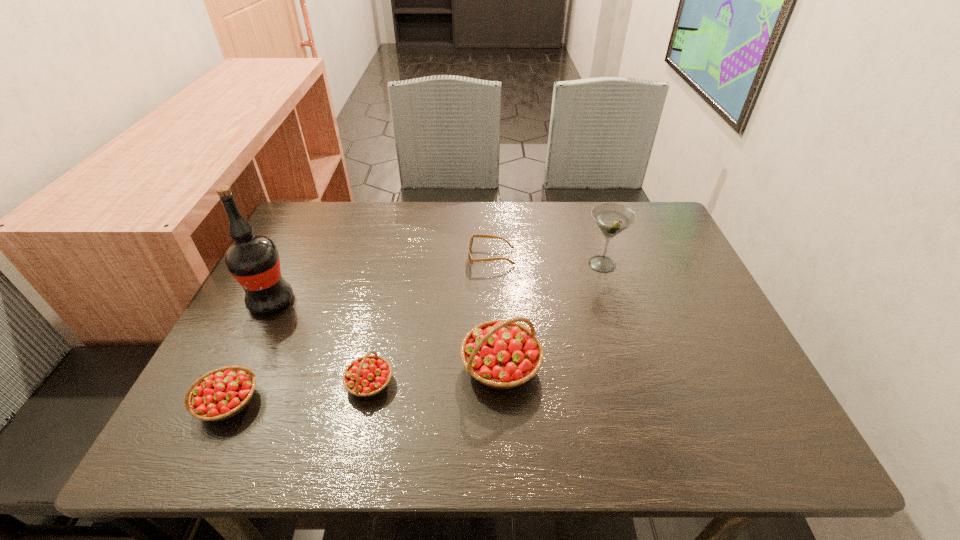
With all strawberrys evenly spaced, where should an extra strawberry be placed on the right to continue the pattern? Please point out a vacant space. Please provide its 2D coordinates. Your answer should be formatted as a tuple, i.e. [(x, y)], where the tuple contains the x and y coordinates of a point satisfying the conditions above.

[(624, 349)]